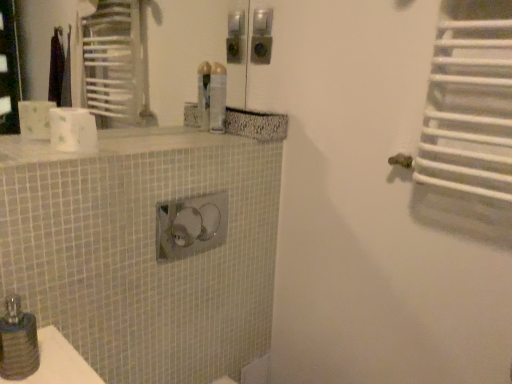
Identify the location of white matte toilet paper at upper left. (73, 130).

Image resolution: width=512 pixels, height=384 pixels. Describe the element at coordinates (112, 144) in the screenshot. I see `white mosaic tile counter top at upper center` at that location.

At what (x,y) coordinates should I click in order to perform the action: click on white matte toilet paper at upper left. Please return your answer as a coordinate pair (x, y). The image size is (512, 384). Looking at the image, I should click on (73, 130).

Is matte black soap dispenser at lower left positioned with its back to white mosaic tile counter top at upper center?

No, matte black soap dispenser at lower left is not facing away from white mosaic tile counter top at upper center.

From the image's perspective, which one is positioned higher, matte black soap dispenser at lower left or white mosaic tile counter top at upper center?

white mosaic tile counter top at upper center is shown above in the image.

Is matte black soap dispenser at lower left positioned far away from white mosaic tile counter top at upper center?

They are positioned close to each other.

From the picture: Does matte black soap dispenser at lower left have a lesser height compared to white mosaic tile counter top at upper center?

No.

The height and width of the screenshot is (384, 512). What are the coordinates of `counter top that is in front of the translucent plastic spray can at upper center` in the screenshot? It's located at (112, 144).

Based on their sizes in the image, would you say white mosaic tile counter top at upper center is bigger or smaller than translucent plastic spray can at upper center?

Clearly, white mosaic tile counter top at upper center is larger in size than translucent plastic spray can at upper center.

Would you say white mosaic tile counter top at upper center is a long distance from translucent plastic spray can at upper center?

white mosaic tile counter top at upper center is actually quite close to translucent plastic spray can at upper center.

Is white mosaic tile counter top at upper center thinner than translucent plastic spray can at upper center?

Incorrect, the width of white mosaic tile counter top at upper center is not less than that of translucent plastic spray can at upper center.

Can you confirm if translucent plastic spray can at upper center is wider than white mosaic tile counter top at upper center?

No.

Who is smaller, translucent plastic spray can at upper center or white mosaic tile counter top at upper center?

translucent plastic spray can at upper center is smaller.

From the image's perspective, which is below, translucent plastic spray can at upper center or white mosaic tile counter top at upper center?

white mosaic tile counter top at upper center is shown below in the image.

Can you tell me how much translucent plastic spray can at upper center and white mosaic tile counter top at upper center differ in facing direction?

The angle between the facing direction of translucent plastic spray can at upper center and the facing direction of white mosaic tile counter top at upper center is 0.611 degrees.

What's the angular difference between white matte toilet paper at upper left and translucent plastic spray can at upper center's facing directions?

0.000608 degrees.

Which point is more forward, [62,128] or [215,127]?

The point [62,128] is closer to the camera.

Is white matte toilet paper at upper left thinner than translucent plastic spray can at upper center?

In fact, white matte toilet paper at upper left might be wider than translucent plastic spray can at upper center.

Is white matte toilet paper at upper left closer to camera compared to translucent plastic spray can at upper center?

Yes, white matte toilet paper at upper left is closer to the viewer.

Is white matte toilet paper at upper left next to white mosaic tile counter top at upper center and touching it?

No, white matte toilet paper at upper left is not beside white mosaic tile counter top at upper center.

Considering the relative sizes of white matte toilet paper at upper left and white mosaic tile counter top at upper center in the image provided, is white matte toilet paper at upper left bigger than white mosaic tile counter top at upper center?

Actually, white matte toilet paper at upper left might be smaller than white mosaic tile counter top at upper center.

From a real-world perspective, who is located lower, white matte toilet paper at upper left or white mosaic tile counter top at upper center?

white mosaic tile counter top at upper center.

Is translucent plastic spray can at upper center facing away from matte black soap dispenser at lower left?

translucent plastic spray can at upper center does not have its back to matte black soap dispenser at lower left.

Is translucent plastic spray can at upper center spatially inside matte black soap dispenser at lower left, or outside of it?

translucent plastic spray can at upper center is not enclosed by matte black soap dispenser at lower left.

From a real-world perspective, is translucent plastic spray can at upper center beneath matte black soap dispenser at lower left?

No.

In the scene shown: Considering the sizes of objects translucent plastic spray can at upper center and matte black soap dispenser at lower left in the image provided, who is shorter, translucent plastic spray can at upper center or matte black soap dispenser at lower left?

matte black soap dispenser at lower left is shorter.

Locate an element on the screen. toilet paper on the left of translucent plastic spray can at upper center is located at coordinates tap(73, 130).

Between translucent plastic spray can at upper center and white matte toilet paper at upper left, which one appears on the left side from the viewer's perspective?

Positioned to the left is white matte toilet paper at upper left.

Is translucent plastic spray can at upper center placed right next to white matte toilet paper at upper left?

There is a gap between translucent plastic spray can at upper center and white matte toilet paper at upper left.

Is translucent plastic spray can at upper center facing towards white matte toilet paper at upper left?

No, translucent plastic spray can at upper center does not turn towards white matte toilet paper at upper left.

This screenshot has width=512, height=384. Find the location of `counter top lying on the right of matte black soap dispenser at lower left`. counter top lying on the right of matte black soap dispenser at lower left is located at coordinates coord(112,144).

In the image, there is a translucent plastic spray can at upper center. Where is `counter top below it (from the image's perspective)`? counter top below it (from the image's perspective) is located at coordinates click(112, 144).

Based on their spatial positions, is white mosaic tile counter top at upper center or white matte toilet paper at upper left closer to translucent plastic spray can at upper center?

Based on the image, white mosaic tile counter top at upper center appears to be nearer to translucent plastic spray can at upper center.

Looking at the image, which one is located further to white matte toilet paper at upper left, translucent plastic spray can at upper center or matte black soap dispenser at lower left?

translucent plastic spray can at upper center is further to white matte toilet paper at upper left.

From the image, which object appears to be nearer to translucent plastic spray can at upper center, matte black soap dispenser at lower left or white mosaic tile counter top at upper center?

The object closer to translucent plastic spray can at upper center is white mosaic tile counter top at upper center.

Looking at this image, based on their spatial positions, is translucent plastic spray can at upper center or matte black soap dispenser at lower left further from white mosaic tile counter top at upper center?

matte black soap dispenser at lower left is positioned further to the anchor white mosaic tile counter top at upper center.

Which object lies nearer to the anchor point white mosaic tile counter top at upper center, white matte toilet paper at upper left or matte black soap dispenser at lower left?

white matte toilet paper at upper left lies closer to white mosaic tile counter top at upper center than the other object.

Which object lies further to the anchor point matte black soap dispenser at lower left, white matte toilet paper at upper left or translucent plastic spray can at upper center?

translucent plastic spray can at upper center.

From the image, which object appears to be nearer to white mosaic tile counter top at upper center, matte black soap dispenser at lower left or translucent plastic spray can at upper center?

Based on the image, translucent plastic spray can at upper center appears to be nearer to white mosaic tile counter top at upper center.

Looking at the image, which one is located further to white matte toilet paper at upper left, translucent plastic spray can at upper center or white mosaic tile counter top at upper center?

The object further to white matte toilet paper at upper left is translucent plastic spray can at upper center.

Find the location of a particular element. The width and height of the screenshot is (512, 384). toilet paper between translucent plastic spray can at upper center and matte black soap dispenser at lower left from top to bottom is located at coordinates (73, 130).

You are a GUI agent. You are given a task and a screenshot of the screen. Output one action in this format:
    pyautogui.click(x=<x>, y=<y>)
    Task: Click on the counter top between matte black soap dispenser at lower left and translucent plastic spray can at upper center in the front-back direction
    The height and width of the screenshot is (384, 512).
    Given the screenshot: What is the action you would take?
    pyautogui.click(x=112, y=144)

Where is `counter top between white matte toilet paper at upper left and matte black soap dispenser at lower left from top to bottom`? counter top between white matte toilet paper at upper left and matte black soap dispenser at lower left from top to bottom is located at coordinates (112, 144).

This screenshot has height=384, width=512. I want to click on toilet paper between white mosaic tile counter top at upper center and translucent plastic spray can at upper center in the front-back direction, so click(73, 130).